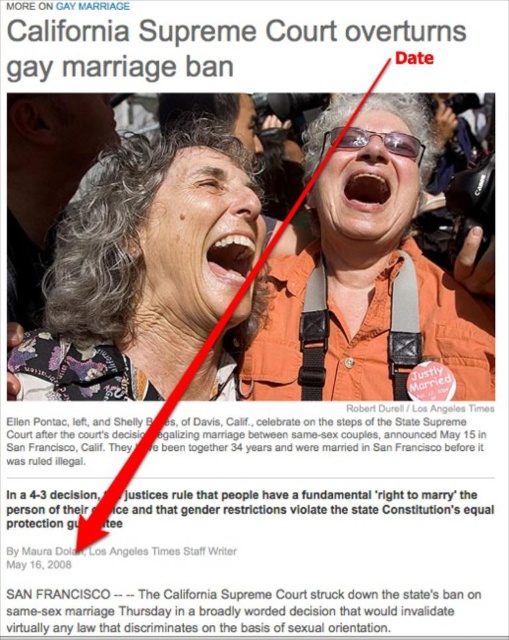
How much distance is there between orange fabric vest at upper center and matte orange shirt at center?

9.43 meters

Which is below, orange fabric vest at upper center or matte orange shirt at center?

Positioned lower is matte orange shirt at center.

Between point (256, 342) and point (149, 292), which one is positioned behind?

Positioned behind is point (256, 342).

The width and height of the screenshot is (509, 640). What are the coordinates of `orange fabric vest at upper center` in the screenshot? It's located at (367, 276).

Does gray textured hair at upper left have a greater height compared to orange fabric vest at upper center?

Incorrect, gray textured hair at upper left's height is not larger of orange fabric vest at upper center's.

What are the coordinates of `gray textured hair at upper left` in the screenshot? It's located at (143, 268).

Is point (224, 348) closer to camera compared to point (184, 340)?

No, (224, 348) is further to viewer.

Can you confirm if gray textured hair at upper left is shorter than matte orange shirt at center?

In fact, gray textured hair at upper left may be taller than matte orange shirt at center.

Identify the location of gray textured hair at upper left. This screenshot has width=509, height=640. (143, 268).